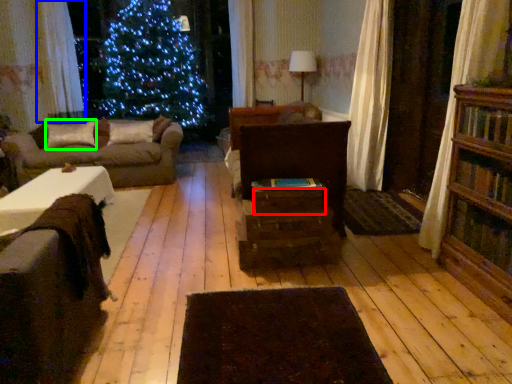
Question: Based on their relative distances, which object is nearer to drawer (highlighted by a red box)? Choose from curtain (highlighted by a blue box) and pillow (highlighted by a green box).

Choices:
 (A) curtain
 (B) pillow

Answer: (B)